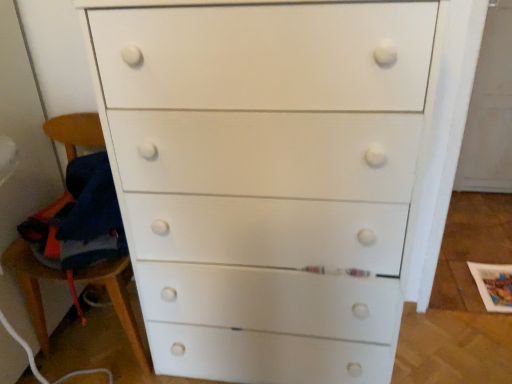
Identify the location of vacant space underneath wooden chair at left (from a real-world perspective). (103, 341).